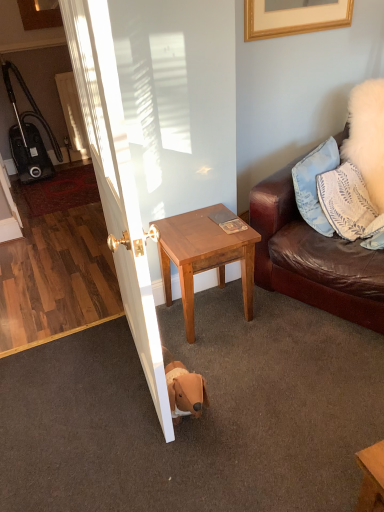
Question: Is black plastic vacuum cleaner at left positioned with its back to white glossy door at center?

Choices:
 (A) yes
 (B) no

Answer: (B)

Question: From a real-world perspective, is black plastic vacuum cleaner at left located beneath white glossy door at center?

Choices:
 (A) yes
 (B) no

Answer: (A)

Question: Is black plastic vacuum cleaner at left beside white glossy door at center?

Choices:
 (A) yes
 (B) no

Answer: (B)

Question: Is black plastic vacuum cleaner at left at the left side of white glossy door at center?

Choices:
 (A) yes
 (B) no

Answer: (A)

Question: Is black plastic vacuum cleaner at left thinner than white glossy door at center?

Choices:
 (A) no
 (B) yes

Answer: (B)

Question: Looking at the image, does blue fabric pillow at upper right, positioned as the first pillow in bottom-to-top order, seem bigger or smaller compared to light brown wood side table at center?

Choices:
 (A) big
 (B) small

Answer: (B)

Question: In the image, is blue fabric pillow at upper right, placed as the second pillow when sorted from top to bottom, on the left side or the right side of light brown wood side table at center?

Choices:
 (A) left
 (B) right

Answer: (B)

Question: From the image's perspective, is blue fabric pillow at upper right, positioned as the first pillow in bottom-to-top order, above or below light brown wood side table at center?

Choices:
 (A) above
 (B) below

Answer: (A)

Question: Relative to light brown wood side table at center, is blue fabric pillow at upper right, positioned as the first pillow in bottom-to-top order, in front or behind?

Choices:
 (A) behind
 (B) front

Answer: (A)

Question: Visually, is blue fabric pillow at upper right, placed as the second pillow when sorted from top to bottom, positioned to the left or to the right of black plastic vacuum cleaner at left?

Choices:
 (A) left
 (B) right

Answer: (B)

Question: Is blue fabric pillow at upper right, positioned as the first pillow in bottom-to-top order, inside or outside of black plastic vacuum cleaner at left?

Choices:
 (A) outside
 (B) inside

Answer: (A)

Question: Considering the positions of point click(x=327, y=208) and point click(x=9, y=128), is point click(x=327, y=208) closer or farther from the camera than point click(x=9, y=128)?

Choices:
 (A) farther
 (B) closer

Answer: (B)

Question: Is blue fabric pillow at upper right, positioned as the first pillow in bottom-to-top order, bigger or smaller than black plastic vacuum cleaner at left?

Choices:
 (A) big
 (B) small

Answer: (B)

Question: Based on their sizes in the image, would you say black plastic vacuum cleaner at left is bigger or smaller than blue fabric pillow at upper right, placed as the second pillow when sorted from top to bottom?

Choices:
 (A) small
 (B) big

Answer: (B)

Question: In the image, is black plastic vacuum cleaner at left on the left side or the right side of blue fabric pillow at upper right, placed as the second pillow when sorted from top to bottom?

Choices:
 (A) right
 (B) left

Answer: (B)